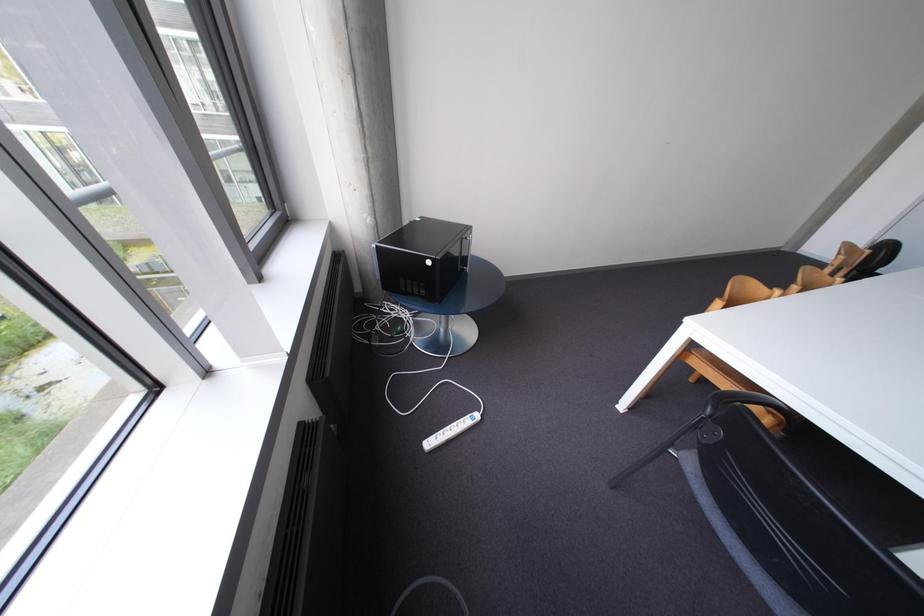
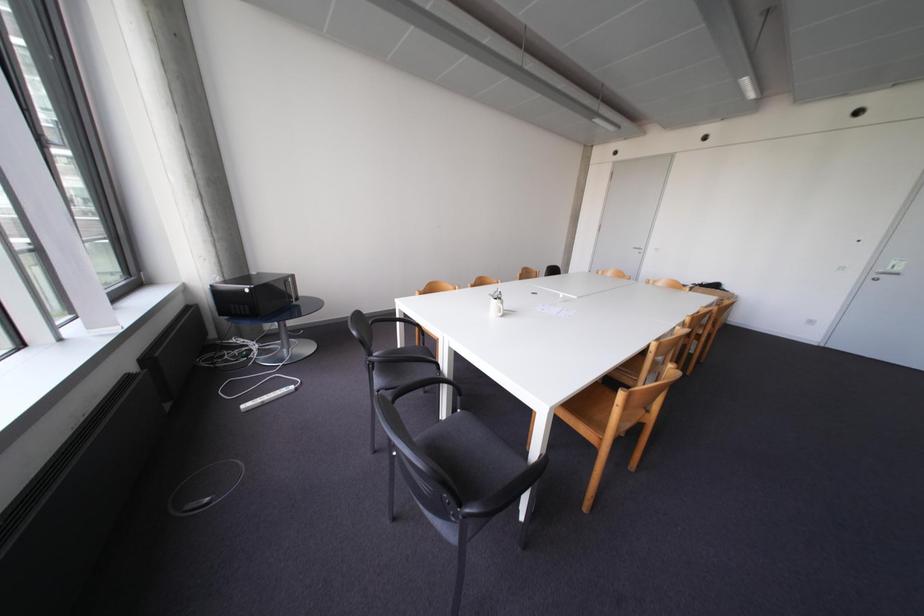
In the scene shown: In a continuous first-person perspective shot, in which direction is the camera moving?

The cameraman walked toward right, backward.